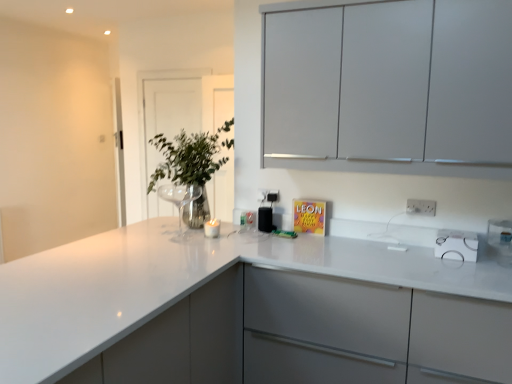
Question: Does metallic glass vase at center have a lesser width compared to black plastic speaker at center?

Choices:
 (A) no
 (B) yes

Answer: (A)

Question: Is metallic glass vase at center taller than black plastic speaker at center?

Choices:
 (A) yes
 (B) no

Answer: (A)

Question: From a real-world perspective, does metallic glass vase at center sit lower than black plastic speaker at center?

Choices:
 (A) no
 (B) yes

Answer: (A)

Question: Is metallic glass vase at center directly adjacent to black plastic speaker at center?

Choices:
 (A) yes
 (B) no

Answer: (B)

Question: Does metallic glass vase at center lie in front of black plastic speaker at center?

Choices:
 (A) no
 (B) yes

Answer: (B)

Question: Are metallic glass vase at center and black plastic speaker at center far apart?

Choices:
 (A) yes
 (B) no

Answer: (A)

Question: Is transparent glass door at upper center taller than white glossy countertop at center?

Choices:
 (A) no
 (B) yes

Answer: (B)

Question: Is transparent glass door at upper center positioned in front of white glossy countertop at center?

Choices:
 (A) no
 (B) yes

Answer: (A)

Question: Can you confirm if transparent glass door at upper center is positioned to the left of white glossy countertop at center?

Choices:
 (A) yes
 (B) no

Answer: (A)

Question: Can you confirm if transparent glass door at upper center is positioned to the right of white glossy countertop at center?

Choices:
 (A) no
 (B) yes

Answer: (A)

Question: Considering the relative sizes of transparent glass door at upper center and white glossy countertop at center in the image provided, is transparent glass door at upper center bigger than white glossy countertop at center?

Choices:
 (A) yes
 (B) no

Answer: (B)

Question: Is transparent glass door at upper center not close to white glossy countertop at center?

Choices:
 (A) no
 (B) yes

Answer: (B)

Question: Could you tell me if metallic glass vase at center is turned towards white glossy countertop at center?

Choices:
 (A) yes
 (B) no

Answer: (B)